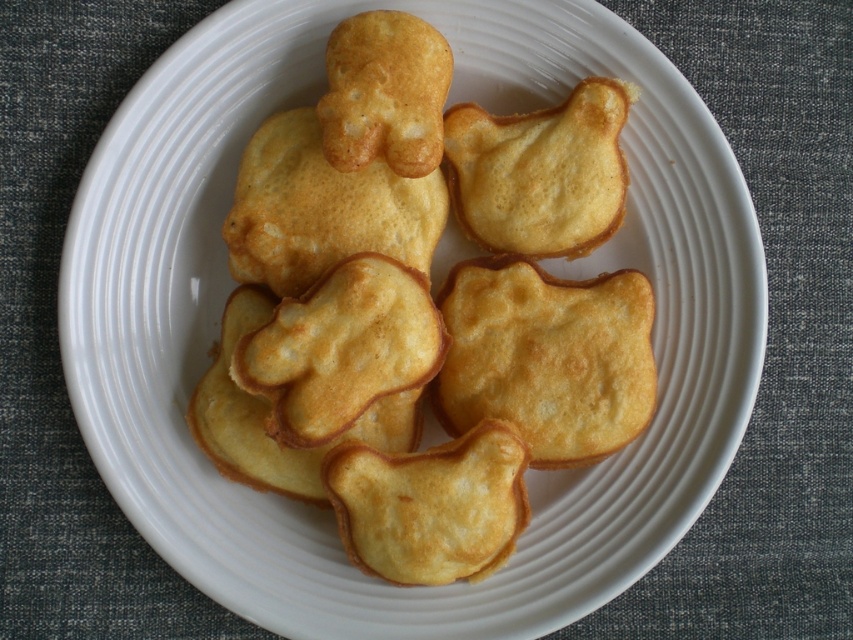
Based on the photo, you are a chef holding a spatula and need to flip the food at point (587, 125). The plate is 1.20 meters away from you. Can you reach it without moving your position?

The distance between you and the food at point (587, 125) is 1.20 meters. Since the spatula can extend your reach, you can likely flip the food without moving.

Consider the image. You are a chef arranging a plate with a golden crispy cat at center and a golden crispy cookie at center. Where should you place the cookie relative to the cat?

The golden crispy cat at center should be placed to the right of the golden crispy cookie at center, so the cookie should be positioned to the left of the cat.